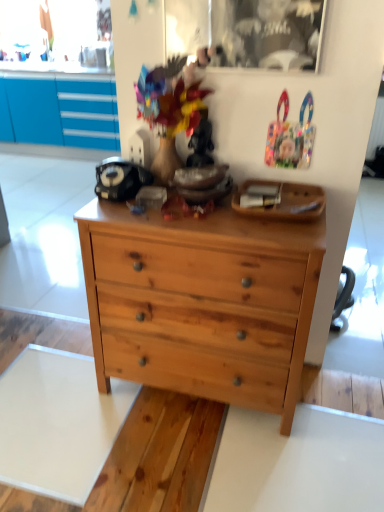
Question: Is natural wood chest of drawers at center to the left or to the right of wooden tray at upper center in the image?

Choices:
 (A) left
 (B) right

Answer: (A)

Question: Is point (132, 271) closer or farther from the camera than point (291, 190)?

Choices:
 (A) closer
 (B) farther

Answer: (A)

Question: Which is nearer to the natural wood chest of drawers at center?

Choices:
 (A) wooden tray at upper center
 (B) transparent glass picture frame at upper center

Answer: (A)

Question: Which of these objects is positioned closest to the wooden tray at upper center?

Choices:
 (A) natural wood chest of drawers at center
 (B) transparent glass picture frame at upper center

Answer: (A)